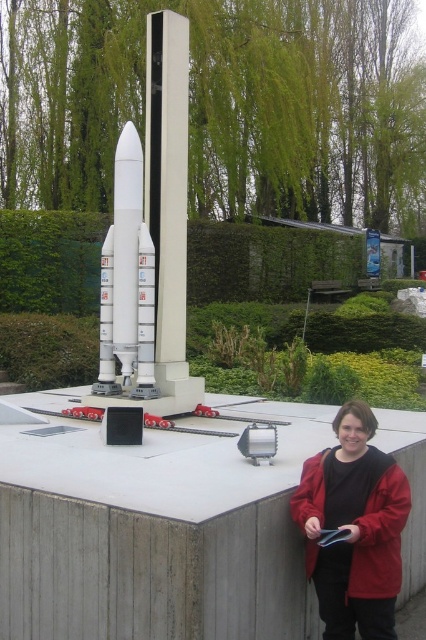
Looking at this image, does black fabric jacket at lower right appear under metallic clipboard at lower right?

No, black fabric jacket at lower right is not below metallic clipboard at lower right.

Who is more distant from viewer, (310,573) or (319,534)?

Point (310,573)

At what (x,y) coordinates should I click in order to perform the action: click on black fabric jacket at lower right. Please return your answer as a coordinate pair (x, y). This screenshot has width=426, height=640. Looking at the image, I should click on (354, 528).

Between point (385, 468) and point (109, 332), which one is positioned in front?

Point (385, 468) is in front.

Between black fabric jacket at lower right and white matte rocket at center, which one appears on the right side from the viewer's perspective?

black fabric jacket at lower right is more to the right.

At what (x,y) coordinates should I click in order to perform the action: click on black fabric jacket at lower right. Please return your answer as a coordinate pair (x, y). This screenshot has height=640, width=426. Looking at the image, I should click on click(x=354, y=528).

Where is `black fabric jacket at lower right`? The width and height of the screenshot is (426, 640). black fabric jacket at lower right is located at coordinates (354, 528).

Can you confirm if white matte rocket at center is smaller than metallic clipboard at lower right?

Incorrect, white matte rocket at center is not smaller in size than metallic clipboard at lower right.

The height and width of the screenshot is (640, 426). I want to click on white matte rocket at center, so click(x=127, y=282).

Is point (126, 316) positioned behind point (325, 531)?

Yes, it is behind point (325, 531).

Locate an element on the screen. white matte rocket at center is located at coordinates (127, 282).